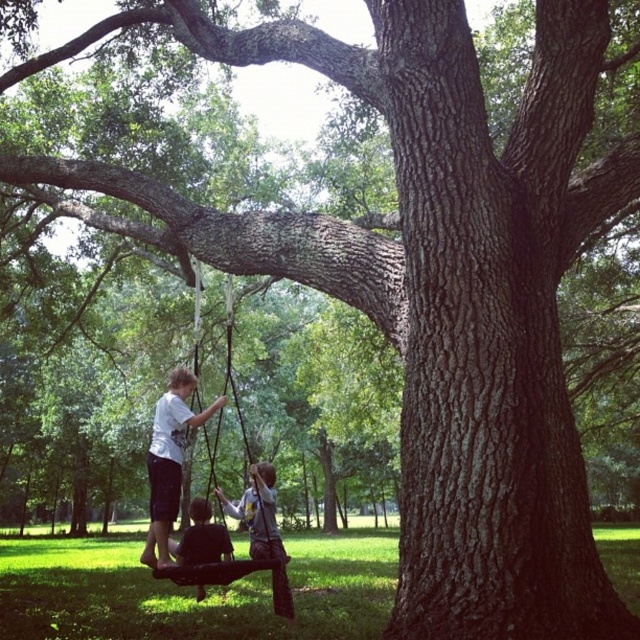
Between white cotton shirt at center and dark brown leather swing at lower center, which one is positioned higher?

white cotton shirt at center is above.

Is the position of white cotton shirt at center more distant than that of dark brown leather swing at lower center?

No, white cotton shirt at center is closer to the viewer.

What do you see at coordinates (170, 460) in the screenshot? The height and width of the screenshot is (640, 640). I see `white cotton shirt at center` at bounding box center [170, 460].

Locate an element on the screen. This screenshot has width=640, height=640. white cotton shirt at center is located at coordinates (170, 460).